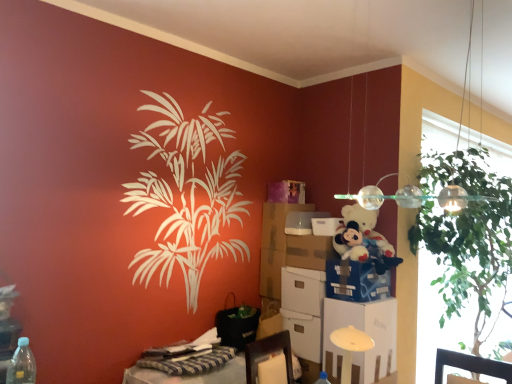
Question: In the image, is transparent glass window screen at right positioned in front of or behind white cardboard box at center, the sixth box in the top-to-bottom sequence?

Choices:
 (A) front
 (B) behind

Answer: (A)

Question: Would you say transparent glass window screen at right is inside or outside white cardboard box at center, the sixth box in the top-to-bottom sequence?

Choices:
 (A) inside
 (B) outside

Answer: (B)

Question: Which object is positioned closest to the clear glass pendant lights at upper right?

Choices:
 (A) white plastic file cabinet at lower right
 (B) white cardboard box at center, the sixth box in the top-to-bottom sequence
 (C) transparent glass window screen at right
 (D) white cardboard box at center, which appears as the second box when viewed from the top
 (E) white cardboard box at center, acting as the first box starting from the top

Answer: (D)

Question: Which of these objects is positioned farthest from the white cardboard box at center, which appears as the second box when viewed from the top?

Choices:
 (A) striped fabric desk at lower left
 (B) blue cardboard box at center, which appears as the fourth box when viewed from the top
 (C) matte cardboard box at center
 (D) transparent glass window screen at right
 (E) white cardboard box at center, acting as the first box starting from the top

Answer: (D)